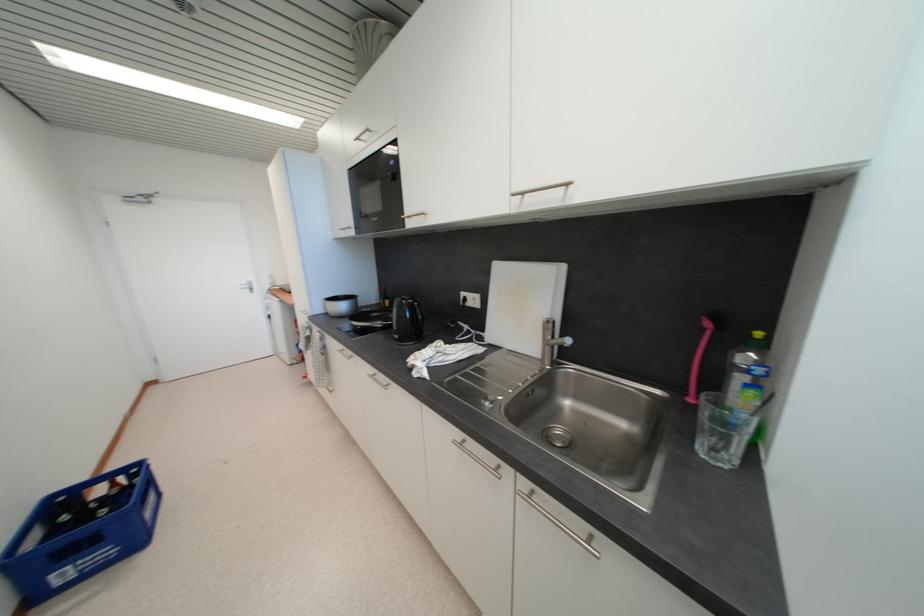
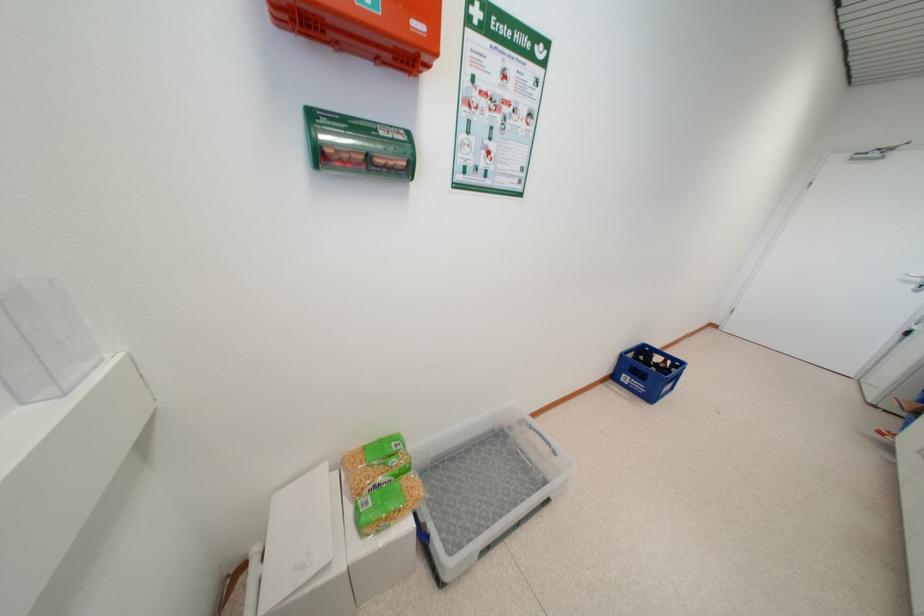
Based on the continuous images, in which direction is the camera rotating?

The rotation direction of the camera is left-down.